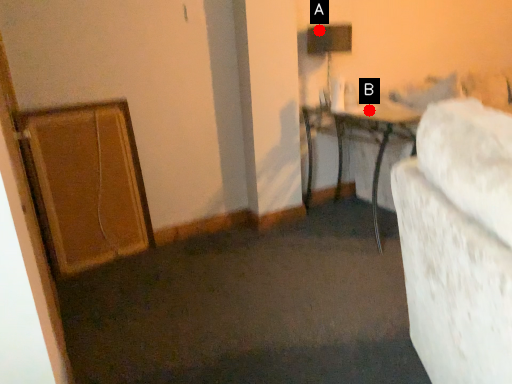
Question: Two points are circled on the image, labeled by A and B beside each circle. Which point appears farthest from the camera in this image?

Choices:
 (A) A is further
 (B) B is further

Answer: (B)